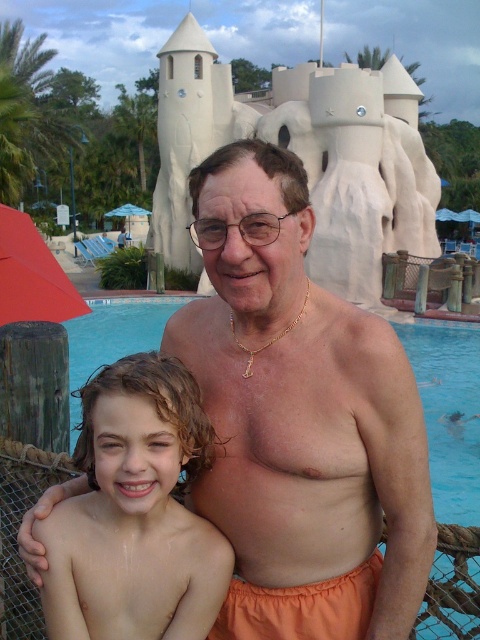
Question: Where is red fabric umbrella at left located in relation to transparent plastic umbrella at upper left in the image?

Choices:
 (A) above
 (B) below

Answer: (B)

Question: Which point is farther to the camera?

Choices:
 (A) red fabric umbrella at left
 (B) orange fabric shorts at center
 (C) light brown curly hair at center

Answer: (A)

Question: Which is nearer to the orange fabric shorts at center?

Choices:
 (A) light brown curly hair at center
 (B) red fabric umbrella at left

Answer: (A)

Question: Where is orange fabric shorts at center located in relation to red fabric umbrella at left in the image?

Choices:
 (A) right
 (B) left

Answer: (A)

Question: Is orange fabric shorts at center closer to camera compared to transparent plastic umbrella at upper left?

Choices:
 (A) no
 (B) yes

Answer: (B)

Question: Which point is farther to the camera?

Choices:
 (A) transparent plastic umbrella at upper left
 (B) light brown curly hair at center
 (C) orange fabric shorts at center
 (D) red fabric umbrella at left

Answer: (A)